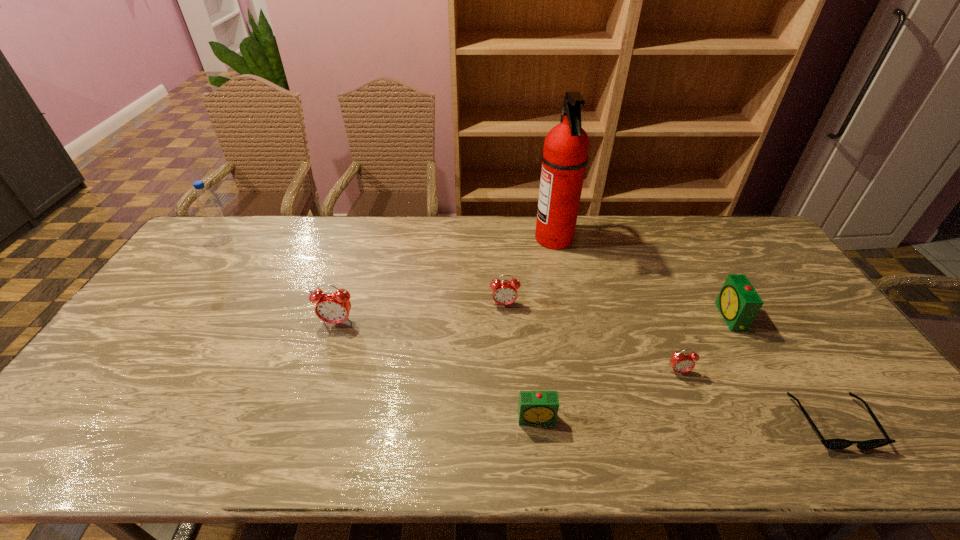
Where is `object present at the left edge`? The image size is (960, 540). object present at the left edge is located at coordinates (220, 231).

Identify the location of object present at the right edge. (835, 444).

Locate an element on the screen. The height and width of the screenshot is (540, 960). object at the far left corner is located at coordinates (220, 231).

You are a GUI agent. You are given a task and a screenshot of the screen. Output one action in this format:
    pyautogui.click(x=<x>, y=<y>)
    Task: Click on the object that is positioned at the near right corner
    
    Given the screenshot: What is the action you would take?
    pyautogui.click(x=835, y=444)

The height and width of the screenshot is (540, 960). Identify the location of vacant space at the far edge of the desktop. tap(592, 225).

Locate an element on the screen. This screenshot has width=960, height=540. vacant space at the near edge of the desktop is located at coordinates (788, 458).

Identify the location of vacant space at the left edge. (168, 284).

In the image, there is a desktop. Where is `vacant space at the right edge`? vacant space at the right edge is located at coordinates (797, 312).

In the image, there is a desktop. At what (x,y) coordinates should I click in order to perform the action: click on free space at the far right corner. Please return your answer as a coordinate pair (x, y). Looking at the image, I should click on (732, 253).

Find the location of a particular element. The width and height of the screenshot is (960, 540). free space between the nearer green alarm clock and the smallest red alarm clock is located at coordinates (608, 395).